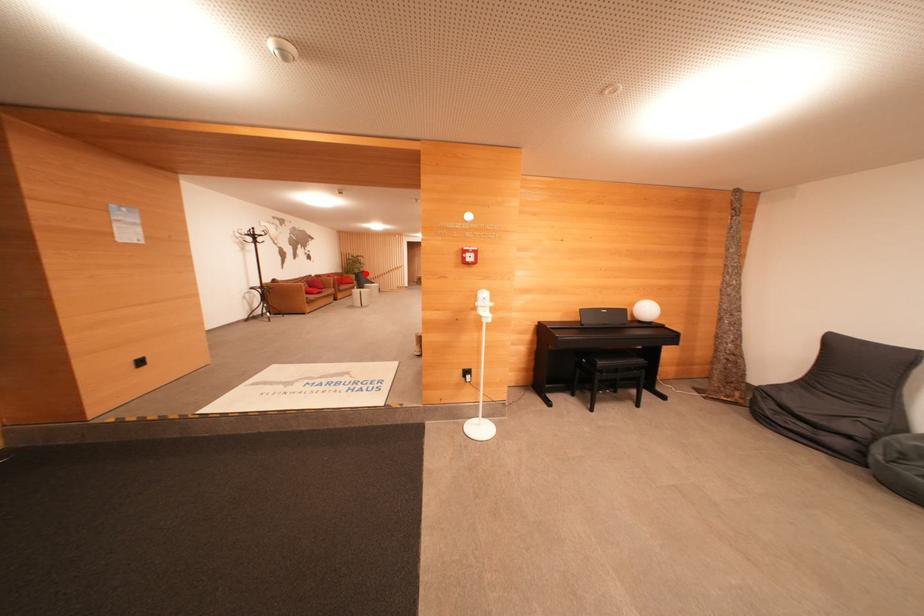
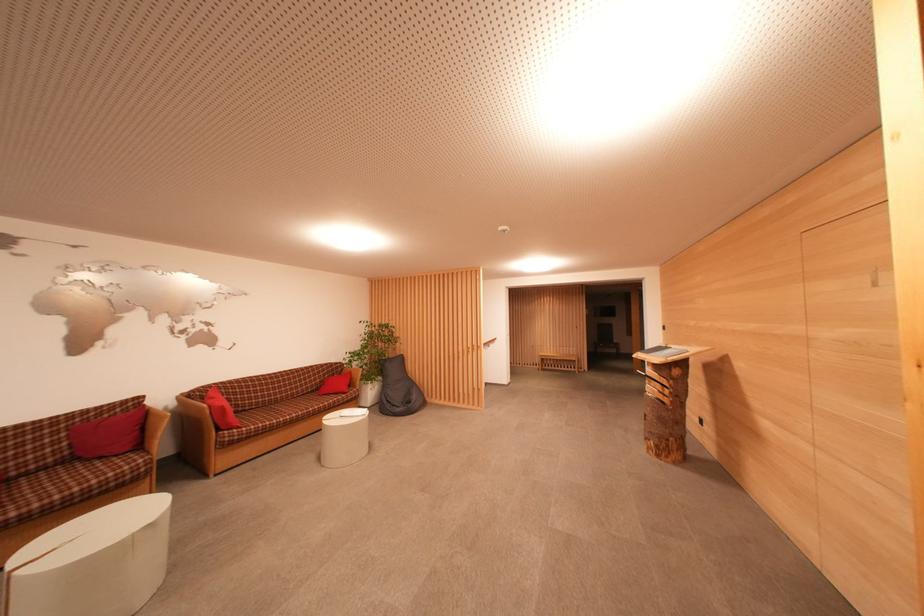
Question: I am providing you with two images of the same scene from different viewpoints. Image1 has a red point marked. In image2, the corresponding 3D location appears at what relative position? Reply with the corresponding letter.

Choices:
 (A) Closer
 (B) Farther

Answer: (B)